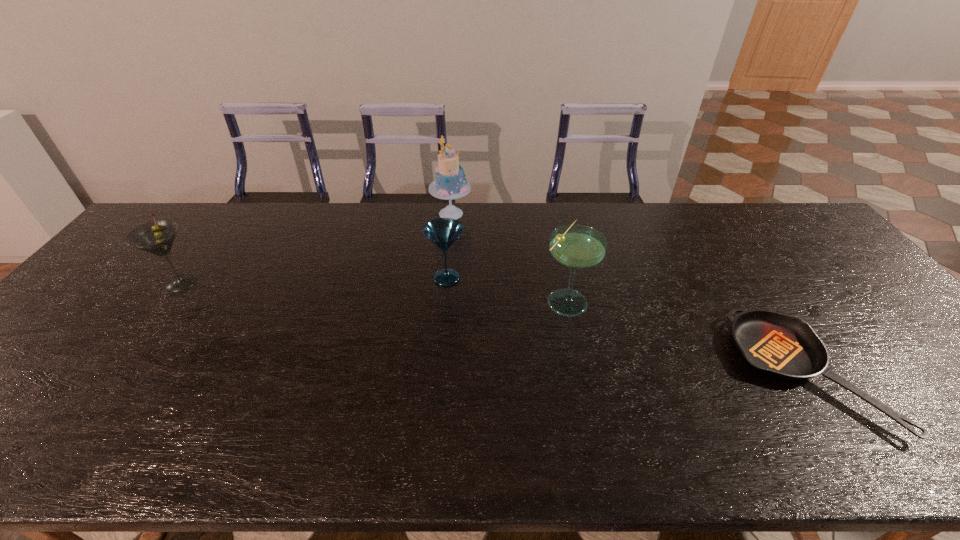
The width and height of the screenshot is (960, 540). I want to click on vacant area that lies between the rightmost martini and the cake, so click(x=509, y=256).

Image resolution: width=960 pixels, height=540 pixels. Identify the location of empty location between the rightmost object and the tallest object. (628, 293).

Image resolution: width=960 pixels, height=540 pixels. What are the coordinates of `free space between the frying pan and the rightmost martini` in the screenshot? It's located at (685, 336).

Where is `vacant area between the tallest object and the leftmost object`? The width and height of the screenshot is (960, 540). vacant area between the tallest object and the leftmost object is located at coordinates (316, 248).

This screenshot has height=540, width=960. What are the coordinates of `free spot between the shortest martini and the second object from right to left` in the screenshot? It's located at (506, 288).

The width and height of the screenshot is (960, 540). What are the coordinates of `vacant area that lies between the leftmost object and the farthest object` in the screenshot? It's located at (316, 248).

Find the location of `free point between the frying pan and the leftmost object`. free point between the frying pan and the leftmost object is located at coordinates (492, 328).

Locate an element on the screen. vacant region between the leftmost object and the rightmost martini is located at coordinates click(373, 291).

Identify which object is located as the nearest to the tallest object. Please provide its 2D coordinates. Your answer should be formatted as a tuple, i.e. [(x, y)], where the tuple contains the x and y coordinates of a point satisfying the conditions above.

[(443, 232)]

Locate an element on the screen. The height and width of the screenshot is (540, 960). object identified as the fourth closest to the rightmost martini is located at coordinates (157, 237).